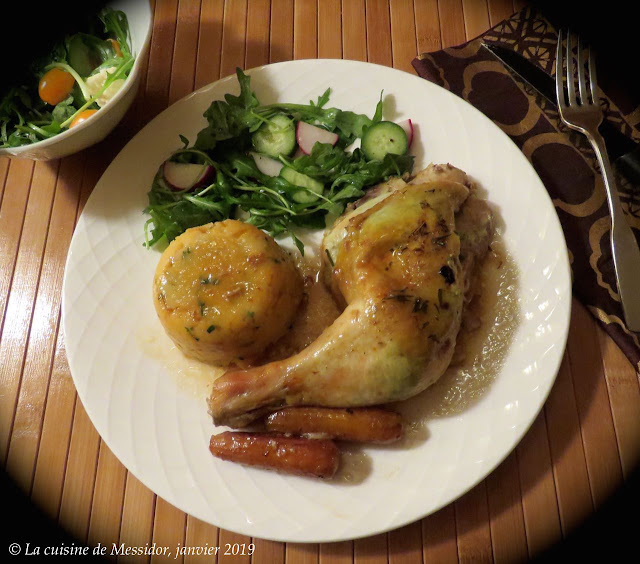
The image size is (640, 564). I want to click on bowl, so click(102, 118).